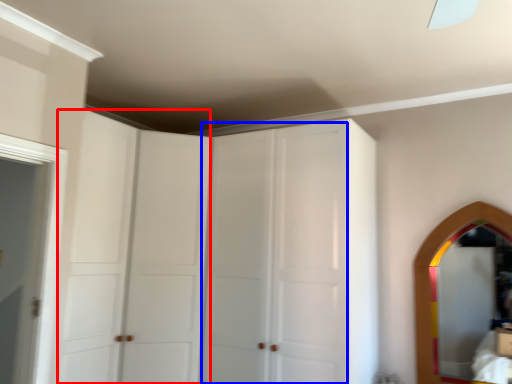
Question: Which object is closer to the camera taking this photo, glass door (highlighted by a red box) or glass door (highlighted by a blue box)?

Choices:
 (A) glass door
 (B) glass door

Answer: (A)